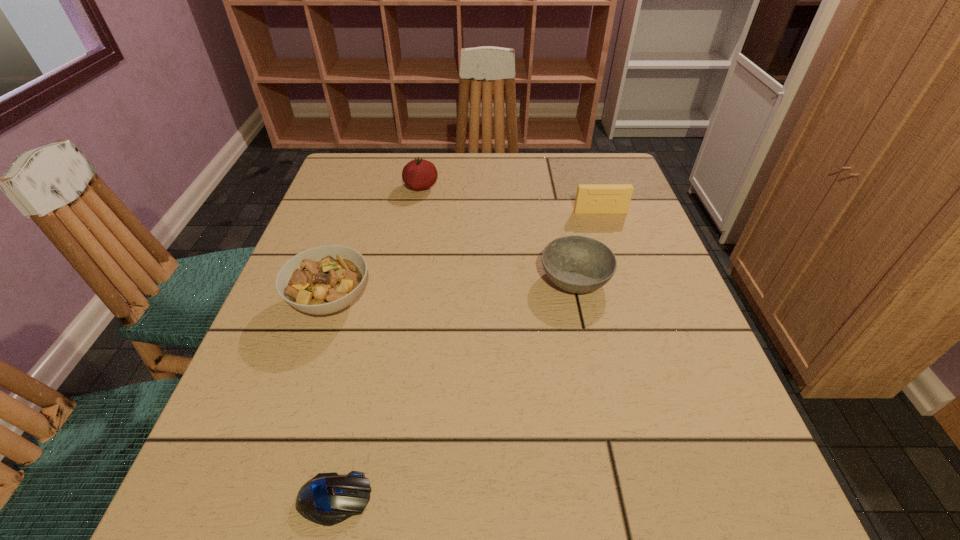
Locate an element on the screen. free spot at the left edge of the desktop is located at coordinates (320, 211).

This screenshot has height=540, width=960. Identify the location of vacant space at the right edge of the desktop. (650, 456).

Where is `free point between the stew and the second shortest object`? The width and height of the screenshot is (960, 540). free point between the stew and the second shortest object is located at coordinates (453, 290).

This screenshot has height=540, width=960. What are the coordinates of `free space between the farthest object and the second shortest object` in the screenshot? It's located at (498, 233).

This screenshot has height=540, width=960. In order to click on free area in between the nearest object and the stew in this screenshot , I will do `click(332, 400)`.

Locate an element on the screen. The height and width of the screenshot is (540, 960). free space that is in between the tomato and the fourth nearest object is located at coordinates (511, 199).

Identify the location of free space between the shortest object and the tomato. (377, 343).

Locate an element on the screen. This screenshot has height=540, width=960. free space between the shortest object and the stew is located at coordinates (332, 400).

The width and height of the screenshot is (960, 540). What are the coordinates of `unoccupied position between the computer mouse and the stew` in the screenshot? It's located at (332, 400).

The image size is (960, 540). In order to click on free space that is in between the bowl and the stew in this screenshot , I will do `click(453, 290)`.